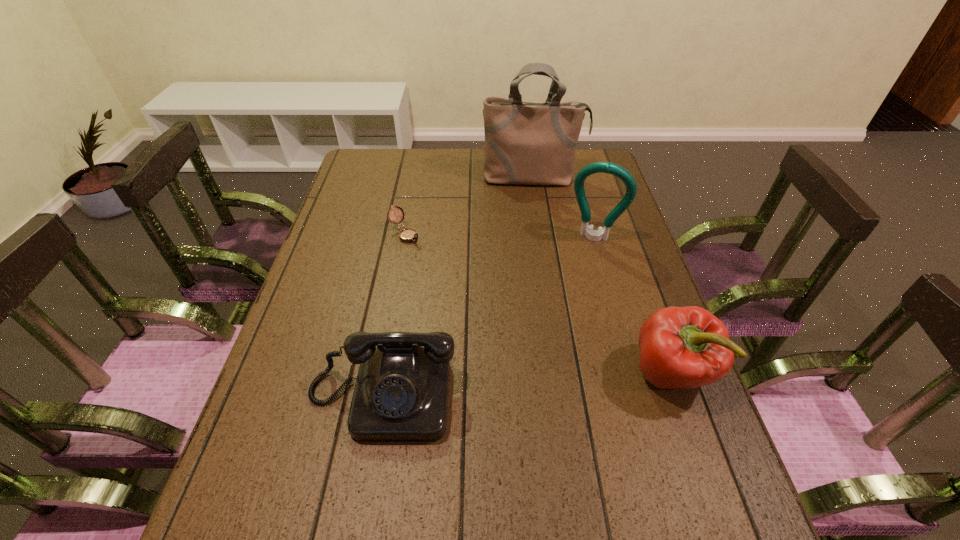
What are the coordinates of `bell pepper that is positioned at the right edge` in the screenshot? It's located at (680, 347).

The height and width of the screenshot is (540, 960). I want to click on bottle opener that is at the right edge, so pos(598,167).

At what (x,y) coordinates should I click in order to perform the action: click on shoulder bag at the right edge. Please return your answer as a coordinate pair (x, y). This screenshot has width=960, height=540. Looking at the image, I should click on point(526,143).

Find the location of `object that is at the near left corner`. object that is at the near left corner is located at coordinates (401, 393).

The width and height of the screenshot is (960, 540). I want to click on object that is at the far right corner, so click(526, 143).

You are a GUI agent. You are given a task and a screenshot of the screen. Output one action in this format:
    pyautogui.click(x=<x>, y=<y>)
    Task: Click on the vacant space at the far edge of the desktop
    The image size is (960, 540).
    Given the screenshot: What is the action you would take?
    pyautogui.click(x=467, y=165)

Locate an element on the screen. The image size is (960, 540). vacant region at the near edge of the desktop is located at coordinates (566, 458).

This screenshot has height=540, width=960. Identify the location of free point at the left edge. (330, 312).

This screenshot has width=960, height=540. In order to click on vacant space at the right edge of the desktop in this screenshot , I will do `click(612, 296)`.

You are a GUI agent. You are given a task and a screenshot of the screen. Output one action in this format:
    pyautogui.click(x=<x>, y=<y>)
    Task: Click on the vacant space at the far left corner
    This screenshot has width=960, height=540.
    Given the screenshot: What is the action you would take?
    pyautogui.click(x=376, y=157)